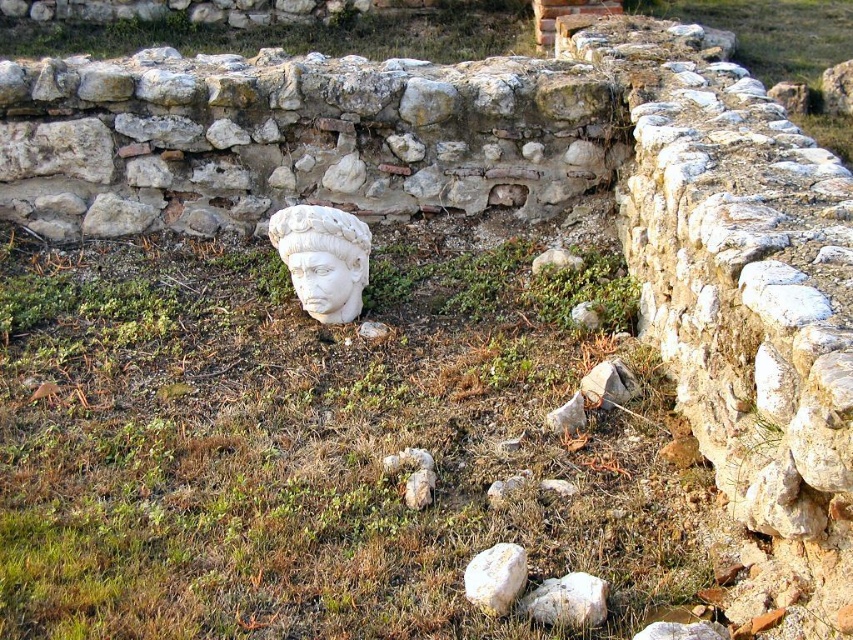
Is white marble bust at center taller than white marble stone at center?

Correct, white marble bust at center is much taller as white marble stone at center.

Between point (317, 248) and point (498, 579), which one is positioned behind?

The point (317, 248) is behind.

Find the location of a particular element. white marble bust at center is located at coordinates (323, 259).

Between white smooth rock at center and white marble stone at center, which one appears on the left side from the viewer's perspective?

From the viewer's perspective, white marble stone at center appears more on the left side.

Does point (573, 621) come in front of point (498, 580)?

Yes, point (573, 621) is in front of point (498, 580).

Is point (537, 608) less distant than point (498, 592)?

That is False.

Find the location of a particular element. white smooth rock at center is located at coordinates (567, 600).

This screenshot has height=640, width=853. Describe the element at coordinates (318, 280) in the screenshot. I see `white marble head at center` at that location.

Can you confirm if white marble head at center is taller than white marble rock at lower center?

Indeed, white marble head at center has a greater height compared to white marble rock at lower center.

Locate an element on the screen. white marble head at center is located at coordinates (318, 280).